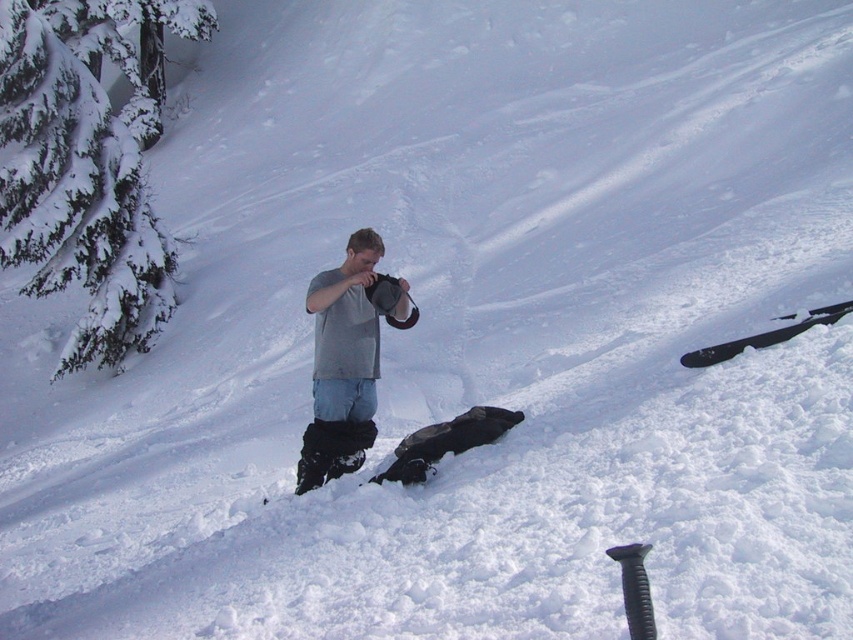
Is green textured pine at upper left taller than gray fabric snowboard at center?

No.

Does point (96, 22) lie in front of point (405, 288)?

No, (96, 22) is further to viewer.

Does point (107, 262) come behind point (355, 371)?

That is True.

Identify the location of green textured pine at upper left. The height and width of the screenshot is (640, 853). (78, 179).